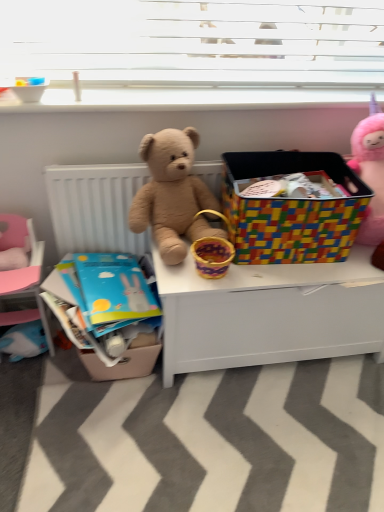
Identify the location of white smooth window sill at upper center. (182, 99).

The image size is (384, 512). What do you see at coordinates (269, 313) in the screenshot?
I see `white matte desk at center` at bounding box center [269, 313].

What do you see at coordinates (172, 194) in the screenshot? Image resolution: width=384 pixels, height=512 pixels. I see `fuzzy brown teddy bear at center` at bounding box center [172, 194].

What is the approximate width of matte cardboard crate at lower left?

15.25 inches.

You are a GUI agent. You are given a task and a screenshot of the screen. Output one action in this format:
    pyautogui.click(x=<x>, y=<y>)
    Task: Click on the matte cardboard crate at lower left
    The height and width of the screenshot is (512, 384).
    Given the screenshot: What is the action you would take?
    pyautogui.click(x=107, y=313)

This screenshot has width=384, height=512. I want to click on white smooth window sill at upper center, so click(x=182, y=99).

I want to click on bed that is under the matte cardboard crate at lower left (from a real-world perspective), so click(x=23, y=274).

From their relative heights in the image, would you say pink fabric bed at lower left is taller or shorter than matte cardboard crate at lower left?

Considering their sizes, pink fabric bed at lower left has more height than matte cardboard crate at lower left.

Is pink fabric bed at lower left further to the viewer compared to matte cardboard crate at lower left?

Yes, the depth of pink fabric bed at lower left is greater than that of matte cardboard crate at lower left.

Is pink fabric bed at lower left turned away from matte cardboard crate at lower left?

No, pink fabric bed at lower left is not facing away from matte cardboard crate at lower left.

Measure the distance between white smooth window sill at upper center and white matte desk at center.

white smooth window sill at upper center is 24.65 inches away from white matte desk at center.

Is white smooth window sill at upper center not inside white matte desk at center?

That's correct, white smooth window sill at upper center is outside of white matte desk at center.

From a real-world perspective, who is located lower, white smooth window sill at upper center or white matte desk at center?

In real-world perspective, white matte desk at center is lower.

Is white smooth window sill at upper center in front of or behind white matte desk at center in the image?

Visually, white smooth window sill at upper center is located behind white matte desk at center.

From the image's perspective, is fuzzy brown teddy bear at center on pink fabric bed at lower left?

Indeed, from the image's perspective, fuzzy brown teddy bear at center is shown above pink fabric bed at lower left.

From a real-world perspective, which object stands above the other?

In real-world perspective, fuzzy brown teddy bear at center is above.

From a real-world perspective, which object stands above the other?

matte cardboard crate at lower left, from a real-world perspective.

Is matte cardboard crate at lower left outside of white matte desk at center?

matte cardboard crate at lower left is positioned outside white matte desk at center.

Considering the relative sizes of matte cardboard crate at lower left and white matte desk at center in the image provided, is matte cardboard crate at lower left thinner than white matte desk at center?

In fact, matte cardboard crate at lower left might be wider than white matte desk at center.

Locate an element on the screen. Image resolution: width=384 pixels, height=512 pixels. box that is on the right side of pink fabric bed at lower left is located at coordinates (292, 209).

In terms of size, does pink fabric bed at lower left appear bigger or smaller than multicolored plastic storage bin at center?

In the image, pink fabric bed at lower left appears to be smaller than multicolored plastic storage bin at center.

Which of these two, pink fabric bed at lower left or multicolored plastic storage bin at center, stands taller?

pink fabric bed at lower left is taller.

Is point (46, 325) closer to camera compared to point (355, 214)?

No, (46, 325) is behind (355, 214).

Considering the relative positions of matte cardboard crate at lower left and pink fabric bed at lower left in the image provided, is matte cardboard crate at lower left to the left of pink fabric bed at lower left from the viewer's perspective?

Incorrect, matte cardboard crate at lower left is not on the left side of pink fabric bed at lower left.

Which is correct: matte cardboard crate at lower left is inside pink fabric bed at lower left, or outside of it?

matte cardboard crate at lower left exists outside the volume of pink fabric bed at lower left.

Is matte cardboard crate at lower left oriented away from pink fabric bed at lower left?

matte cardboard crate at lower left is not turned away from pink fabric bed at lower left.

Does matte cardboard crate at lower left have a greater width compared to pink fabric bed at lower left?

Yes, matte cardboard crate at lower left is wider than pink fabric bed at lower left.

From the image's perspective, who appears lower, fluffy pink unicorn at upper right or pink fabric bed at lower left?

pink fabric bed at lower left.

Between point (362, 132) and point (42, 247), which one is positioned behind?

The point (42, 247) is farther from the camera.

From a real-world perspective, who is located lower, fluffy pink unicorn at upper right or pink fabric bed at lower left?

pink fabric bed at lower left, from a real-world perspective.

Considering the relative positions of fluffy pink unicorn at upper right and pink fabric bed at lower left in the image provided, is fluffy pink unicorn at upper right to the left of pink fabric bed at lower left from the viewer's perspective?

Incorrect, fluffy pink unicorn at upper right is not on the left side of pink fabric bed at lower left.

The image size is (384, 512). What are the coordinates of `crate above the pink fabric bed at lower left (from the image's perspective)` in the screenshot? It's located at (107, 313).

Identify the location of window sill behind the white matte desk at center. (182, 99).

When comparing their distances from white smooth window sill at upper center, does pink fabric bed at lower left or matte cardboard crate at lower left seem further?

matte cardboard crate at lower left lies further to white smooth window sill at upper center than the other object.

Based on their spatial positions, is fluffy pink unicorn at upper right or fuzzy brown teddy bear at center further from pink fabric bed at lower left?

fluffy pink unicorn at upper right.

Which object lies further to the anchor point fluffy pink unicorn at upper right, white smooth window sill at upper center or pink fabric bed at lower left?

pink fabric bed at lower left.

From the image, which object appears to be nearer to multicolored plastic storage bin at center, pink fabric bed at lower left or matte cardboard crate at lower left?

Among the two, matte cardboard crate at lower left is located nearer to multicolored plastic storage bin at center.

Which object lies nearer to the anchor point white smooth window sill at upper center, white matte desk at center or pink fabric bed at lower left?

pink fabric bed at lower left.

Which object lies further to the anchor point matte cardboard crate at lower left, white smooth window sill at upper center or pink fabric bed at lower left?

The object further to matte cardboard crate at lower left is white smooth window sill at upper center.

Considering their positions, is fuzzy brown teddy bear at center positioned closer to pink fabric bed at lower left than white smooth window sill at upper center?

fuzzy brown teddy bear at center is positioned closer to the anchor pink fabric bed at lower left.

Based on their spatial positions, is white matte desk at center or white smooth window sill at upper center further from fuzzy brown teddy bear at center?

The object further to fuzzy brown teddy bear at center is white smooth window sill at upper center.

This screenshot has width=384, height=512. I want to click on teddy bear between matte cardboard crate at lower left and multicolored plastic storage bin at center from left to right, so click(x=172, y=194).

The width and height of the screenshot is (384, 512). I want to click on box between fluffy pink unicorn at upper right and white matte desk at center in the up-down direction, so click(x=292, y=209).

Where is `window sill between pink fabric bed at lower left and white matte desk at center from left to right`? window sill between pink fabric bed at lower left and white matte desk at center from left to right is located at coordinates (182, 99).

The image size is (384, 512). Find the location of `box between fuzzy brown teddy bear at center and fluffy pink unicorn at upper right in the horizontal direction`. box between fuzzy brown teddy bear at center and fluffy pink unicorn at upper right in the horizontal direction is located at coordinates (292, 209).